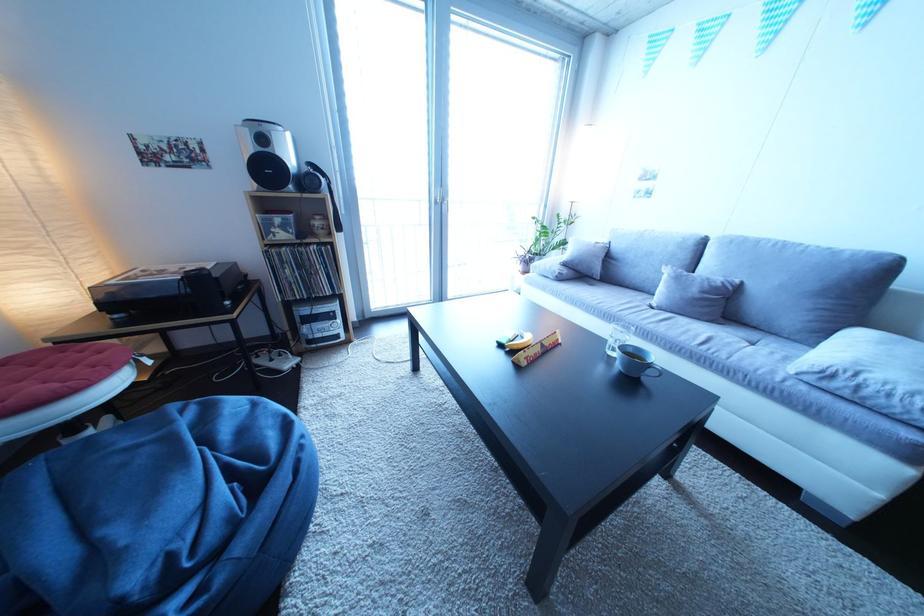
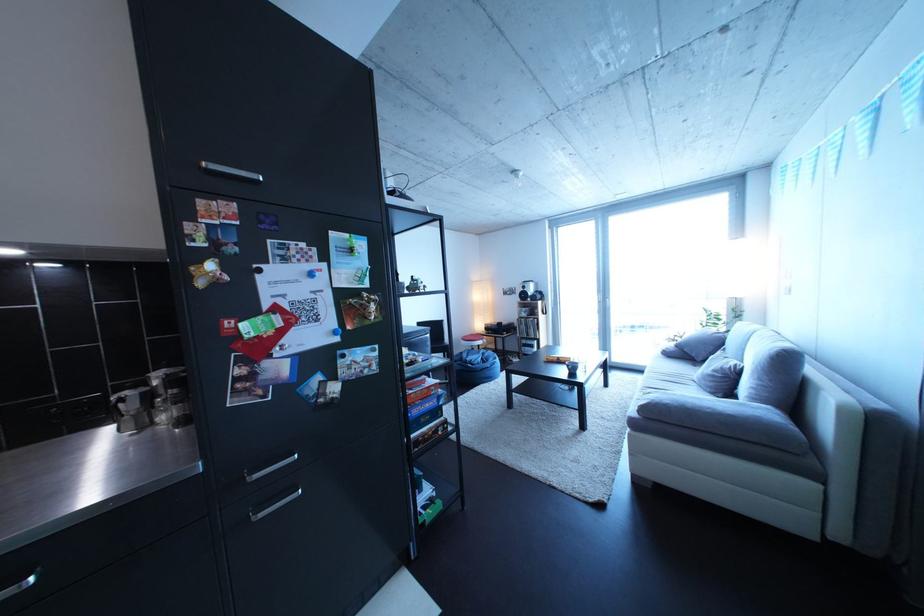
The point at (716, 299) is marked in the first image. Where is the corresponding point in the second image?

(727, 377)